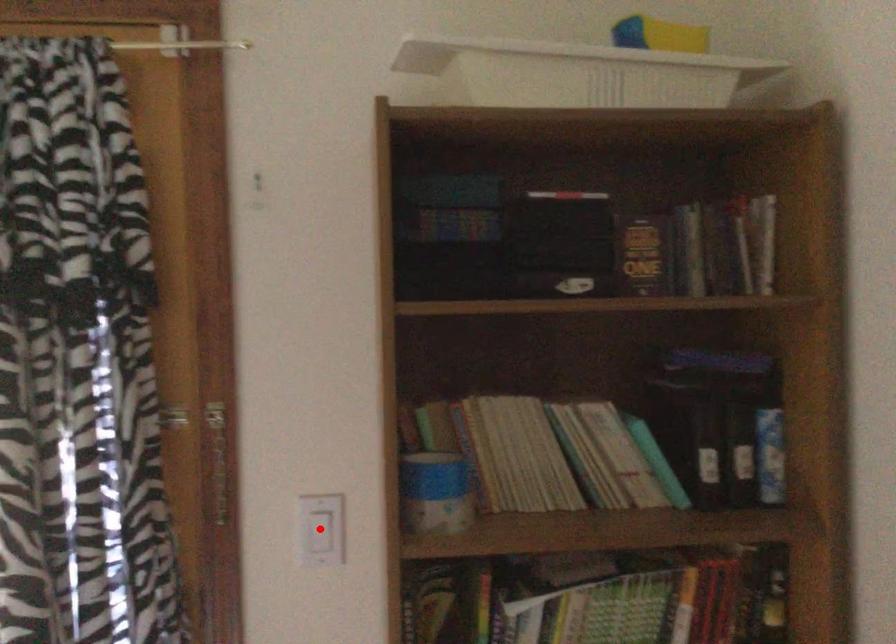
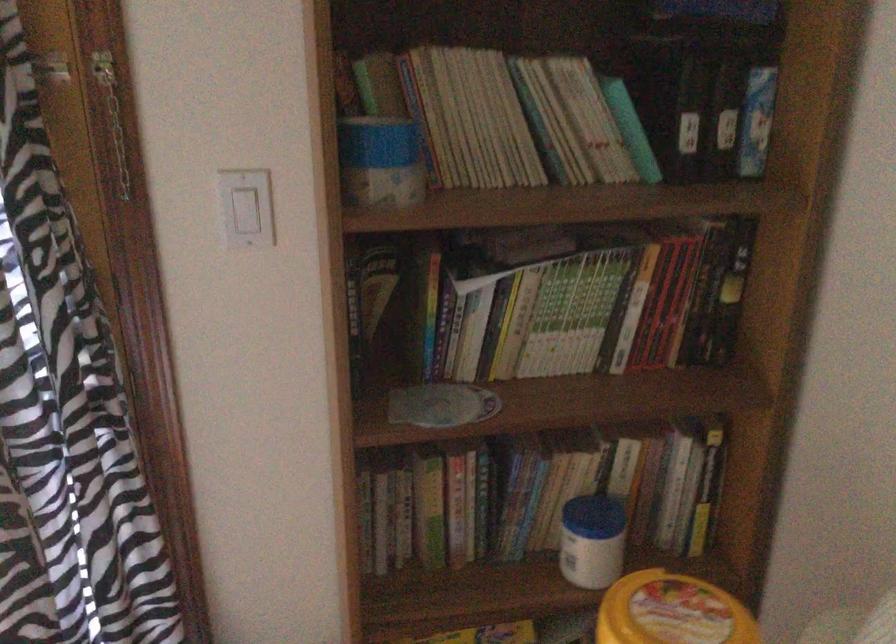
Question: I am providing you with two images of the same scene from different viewpoints. Image1 has a red point marked. In image2, the corresponding 3D location appears at what relative position? Reply with the corresponding letter.

Choices:
 (A) Closer
 (B) Farther

Answer: (A)